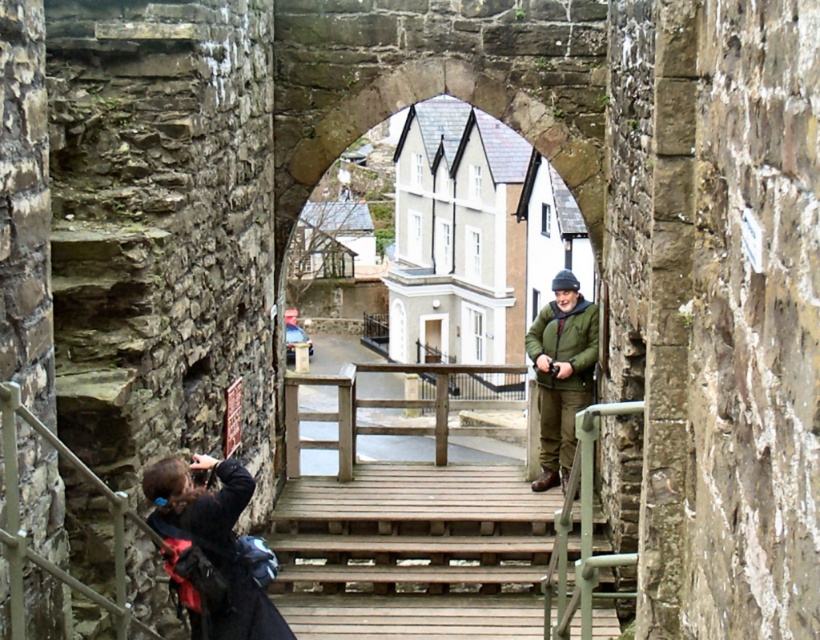
Question: Does dark blue fabric at lower left lie in front of green matte jacket at center?

Choices:
 (A) no
 (B) yes

Answer: (B)

Question: Which point is closer to the camera taking this photo?

Choices:
 (A) 541,474
 (B) 224,595

Answer: (B)

Question: Which point is closer to the camera?

Choices:
 (A) green matte jacket at center
 (B) dark blue fabric at lower left

Answer: (B)

Question: Does dark blue fabric at lower left appear on the left side of green matte jacket at center?

Choices:
 (A) no
 (B) yes

Answer: (B)

Question: Is dark blue fabric at lower left below green matte jacket at center?

Choices:
 (A) yes
 (B) no

Answer: (A)